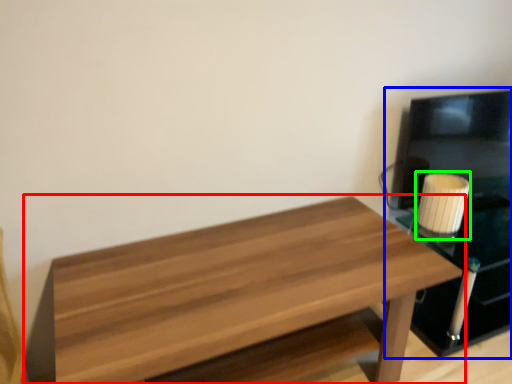
Question: Which object is positioned farthest from table (highlighted by a red box)? Select from entertainment center (highlighted by a blue box) and candle holder (highlighted by a green box).

Choices:
 (A) entertainment center
 (B) candle holder

Answer: (A)